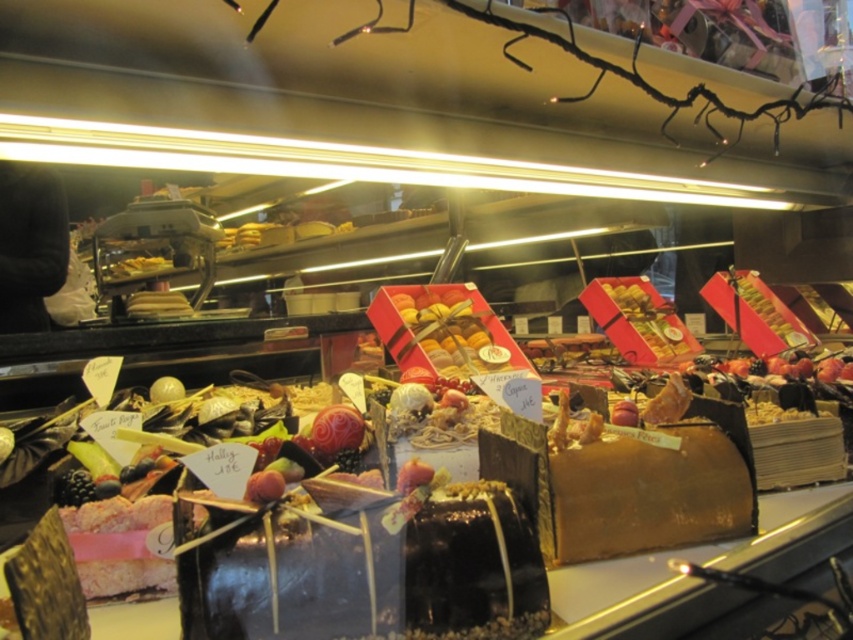
Between point (318, 588) and point (735, 497), which one is positioned in front?

Point (318, 588)

Is chocolate glazed cake at center bigger than golden textured cake at center?

Actually, chocolate glazed cake at center might be smaller than golden textured cake at center.

Is point (427, 582) more distant than point (618, 518)?

No.

You are a GUI agent. You are given a task and a screenshot of the screen. Output one action in this format:
    pyautogui.click(x=<x>, y=<y>)
    Task: Click on the chocolate glazed cake at center
    
    Given the screenshot: What is the action you would take?
    pyautogui.click(x=360, y=566)